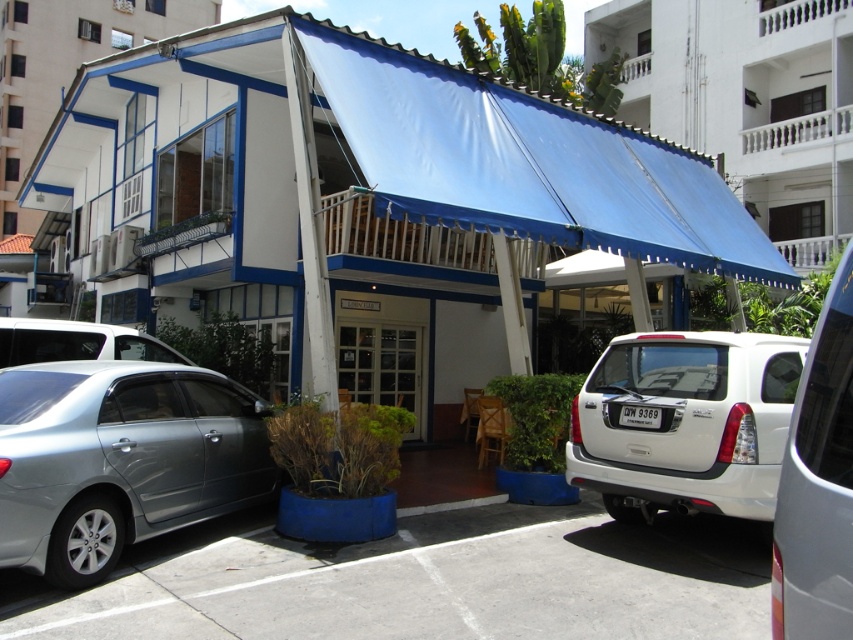
You are a customer arriving at Luna Cafe and want to enter the building. You see the white matte building at center and the blue fabric awning at upper center. Which object is directly above the entrance where you need to walk towards?

The blue fabric awning at upper center is directly above the entrance to the white matte building at center.

Consider the image. You are standing at the origin point of the coordinate system. You want to walk directly to the white matte building at center. In which direction should you move? Please provide your answer in terms of the coordinate system.

Since the white matte building at center is located at coordinate point (358, 204), you should move in the positive x and positive y direction to reach it from the origin.